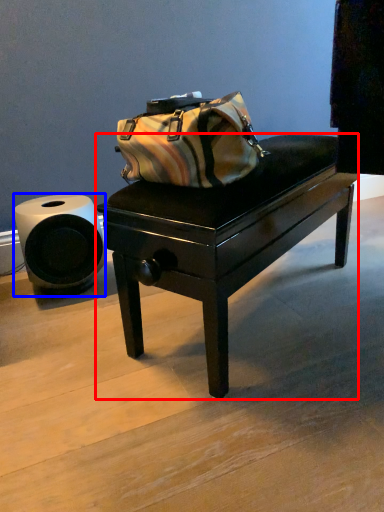
Question: Which of the following is the closest to the observer, table (highlighted by a red box) or toilet paper (highlighted by a blue box)?

Choices:
 (A) table
 (B) toilet paper

Answer: (A)